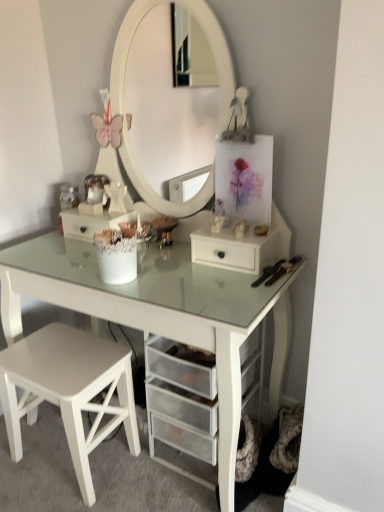
Question: Looking at the image, does white glass table at center seem bigger or smaller compared to white matte drawer at center?

Choices:
 (A) big
 (B) small

Answer: (A)

Question: From a real-world perspective, is white glass table at center positioned above or below white matte drawer at center?

Choices:
 (A) below
 (B) above

Answer: (B)

Question: Estimate the real-world distances between objects in this image. Which object is farther from the white matte stool at lower left?

Choices:
 (A) white glass table at center
 (B) white matte drawer at center
 (C) white mesh drawer at center

Answer: (B)

Question: Which of these objects is positioned farthest from the white matte drawer at center?

Choices:
 (A) white matte stool at lower left
 (B) white glass table at center
 (C) white mesh drawer at center

Answer: (A)